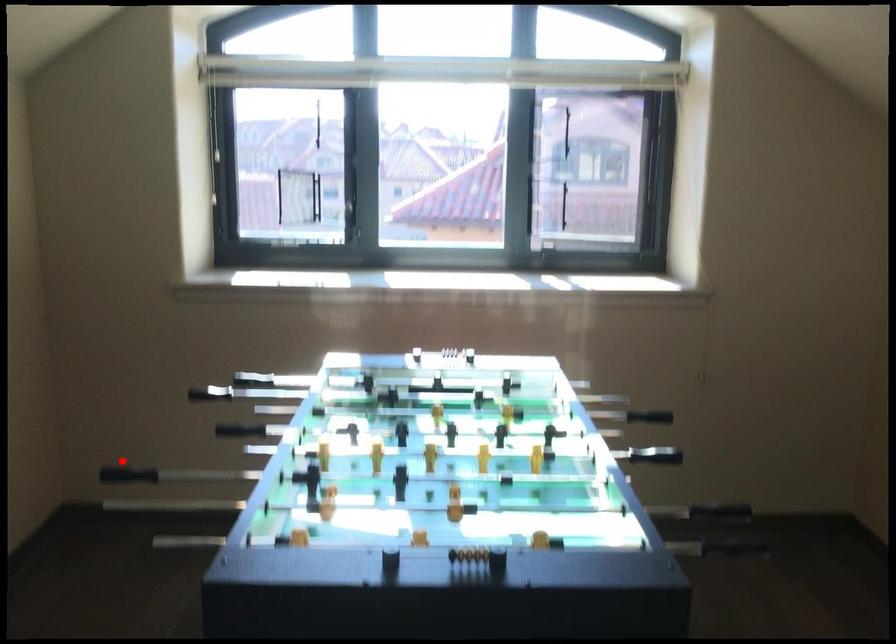
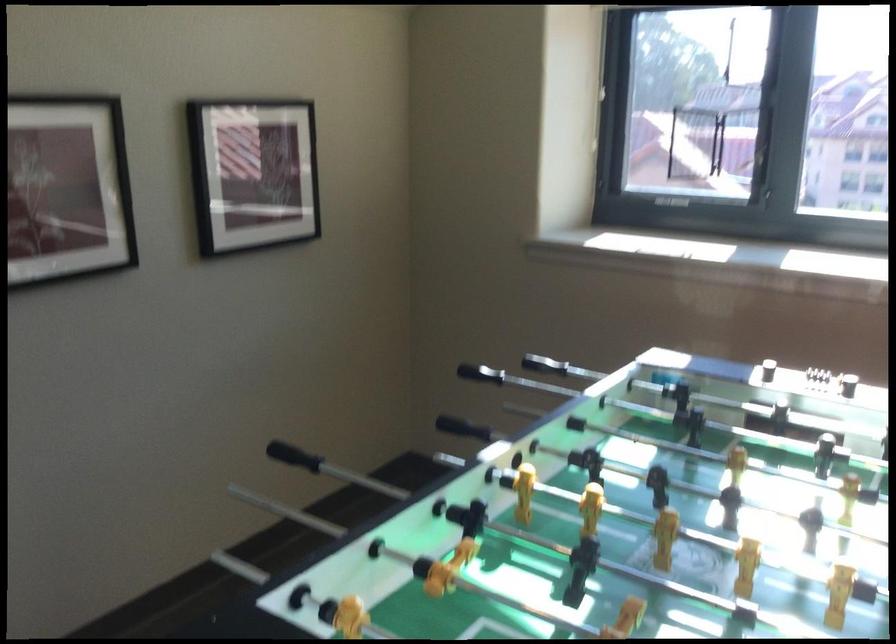
Find the pixel in the second image that matches the highlighted location in the first image.

(463, 428)